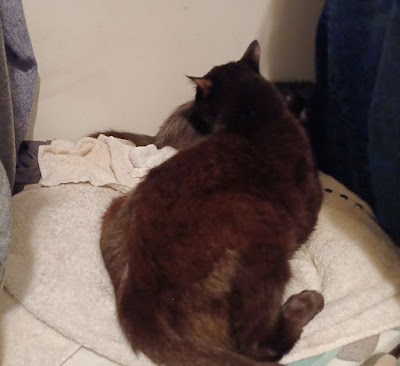
Locate an element on the screen. checked blanket is located at coordinates (367, 349).